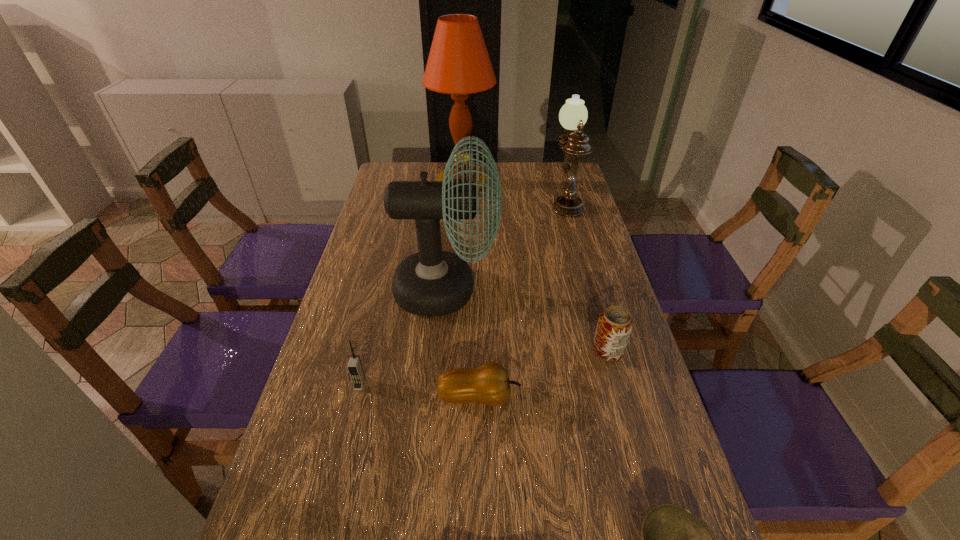
In order to click on free space located on the front-facing side of the cellular telephone in this screenshot , I will do `click(348, 430)`.

Locate an element on the screen. The width and height of the screenshot is (960, 540). free region located on the left of the fourth nearest object is located at coordinates (497, 350).

In order to click on blank area located 0.280m on the stem side of the sixth tallest object in this screenshot , I will do `click(642, 396)`.

The height and width of the screenshot is (540, 960). I want to click on lamp present at the far edge, so click(458, 64).

Locate an element on the screen. The height and width of the screenshot is (540, 960). oil lamp positioned at the far edge is located at coordinates (573, 115).

At what (x,y) coordinates should I click in order to perform the action: click on lamp at the left edge. Please return your answer as a coordinate pair (x, y). The height and width of the screenshot is (540, 960). Looking at the image, I should click on (458, 64).

The width and height of the screenshot is (960, 540). In order to click on fan situated at the left edge in this screenshot , I will do `click(432, 282)`.

The height and width of the screenshot is (540, 960). I want to click on cellular telephone located at the left edge, so click(355, 368).

Identify the location of oil lamp situated at the right edge. (573, 115).

Locate an element on the screen. The image size is (960, 540). beer can that is at the right edge is located at coordinates (615, 324).